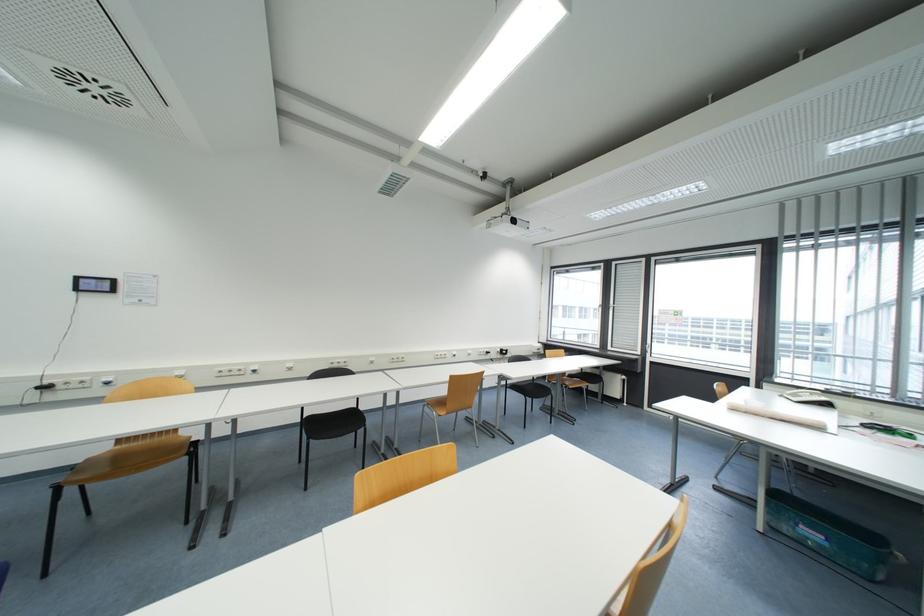
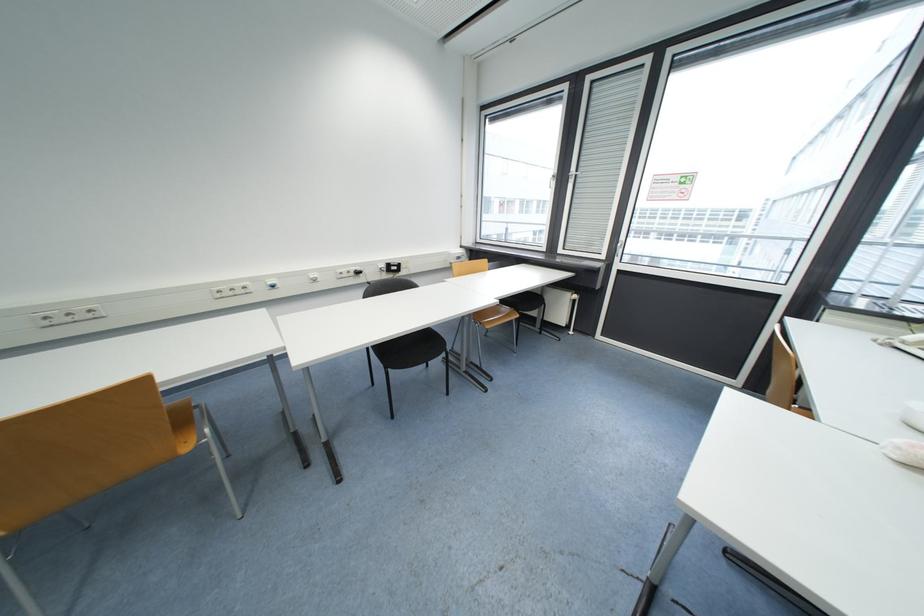
The images are taken continuously from a first-person perspective. In which direction are you moving?

The cameraman moved toward right, forward.